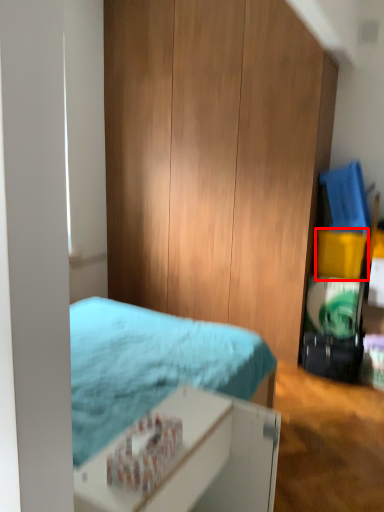
Question: Observing the image, what is the correct spatial positioning of box (annotated by the red box) in reference to bed?

Choices:
 (A) right
 (B) left

Answer: (A)